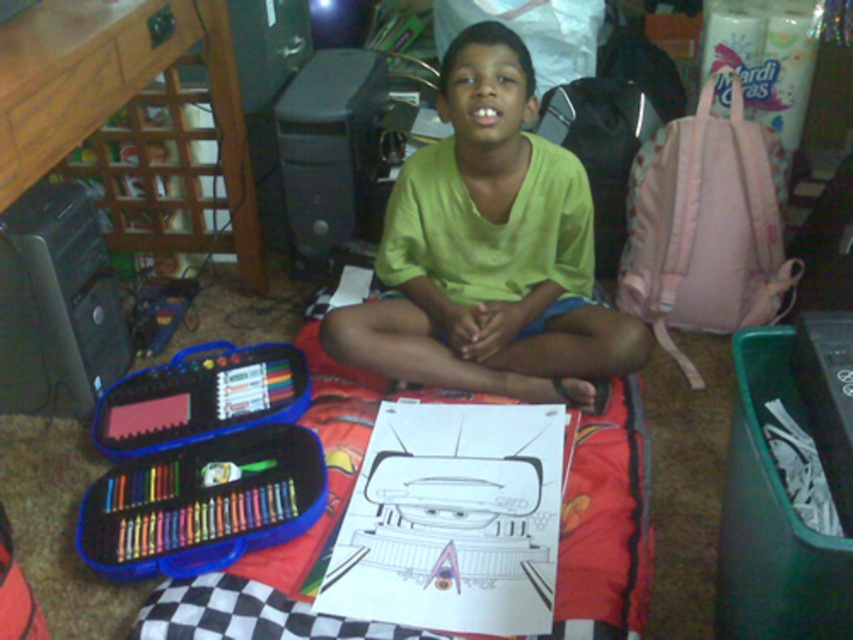
Does green matte shirt at center have a smaller size compared to black checkered blanket at center?

Indeed, green matte shirt at center has a smaller size compared to black checkered blanket at center.

Does green matte shirt at center have a lesser width compared to black checkered blanket at center?

Correct, green matte shirt at center's width is less than black checkered blanket at center's.

The height and width of the screenshot is (640, 853). What are the coordinates of `green matte shirt at center` in the screenshot? It's located at (489, 252).